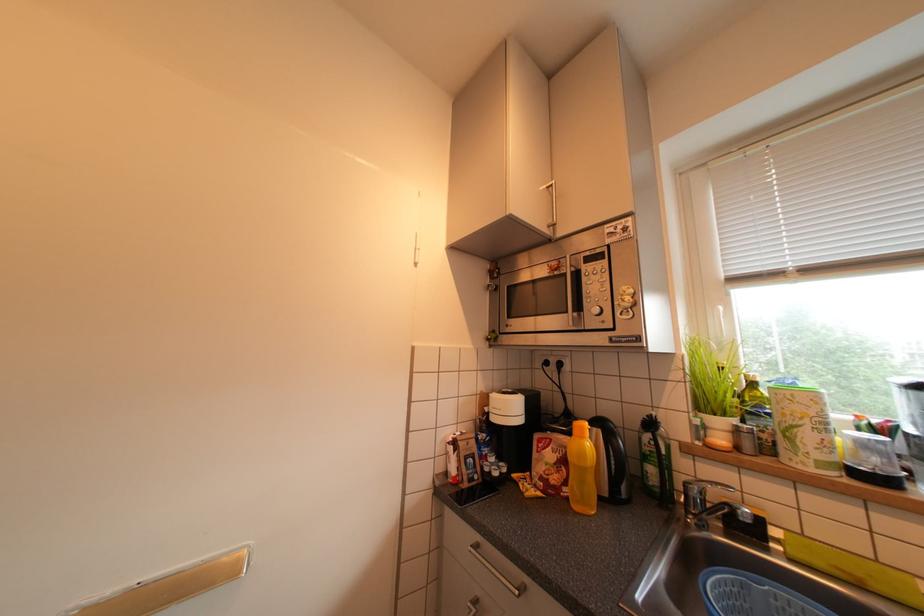
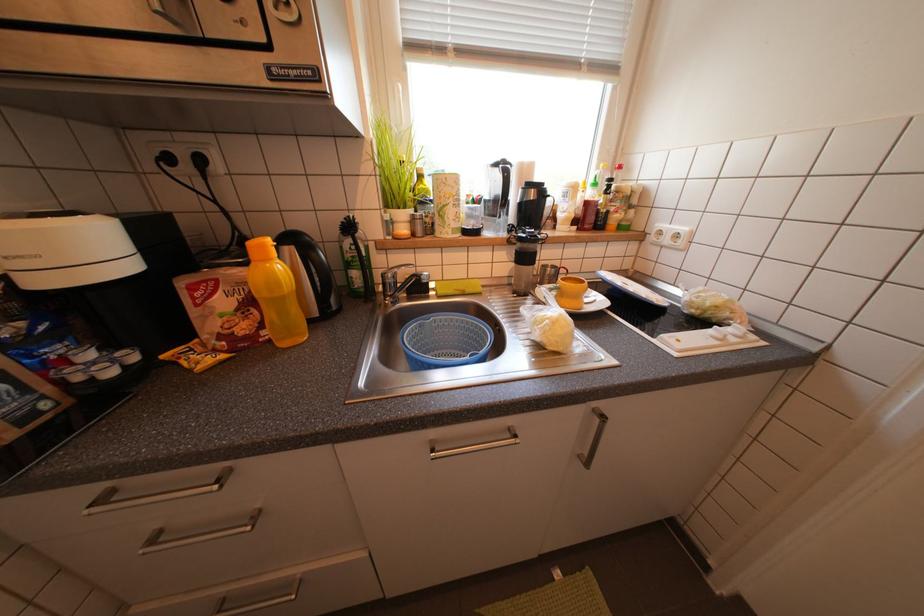
Based on the continuous images, in which direction is the camera rotating?

The camera's rotation is toward right-down.